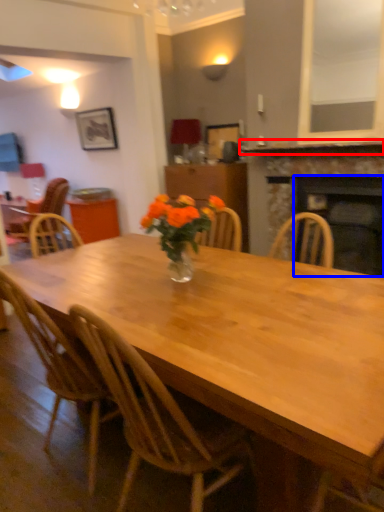
Question: Among these objects, which one is farthest to the camera, mantle (highlighted by a red box) or fireplace (highlighted by a blue box)?

Choices:
 (A) mantle
 (B) fireplace

Answer: (B)